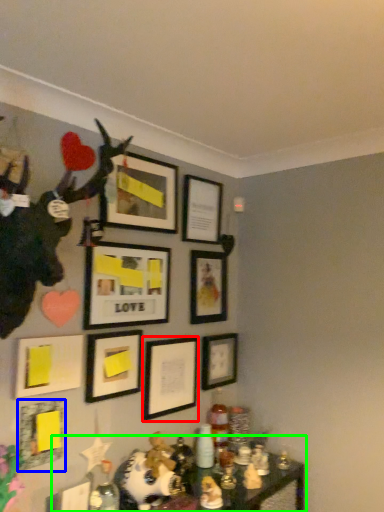
Question: Which object is positioned farthest from picture frame (highlighted by a red box)? Select from picture frame (highlighted by a blue box) and table (highlighted by a green box).

Choices:
 (A) picture frame
 (B) table

Answer: (A)